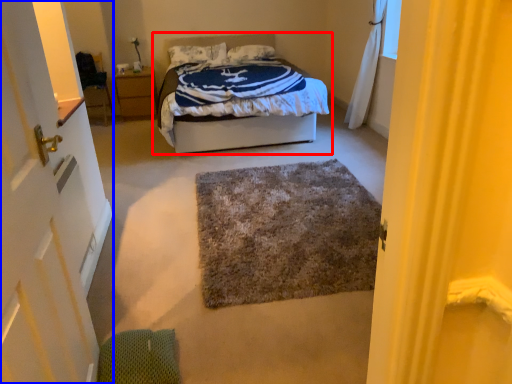
Question: Which object appears closest to the camera in this image, bed (highlighted by a red box) or door (highlighted by a blue box)?

Choices:
 (A) bed
 (B) door

Answer: (B)